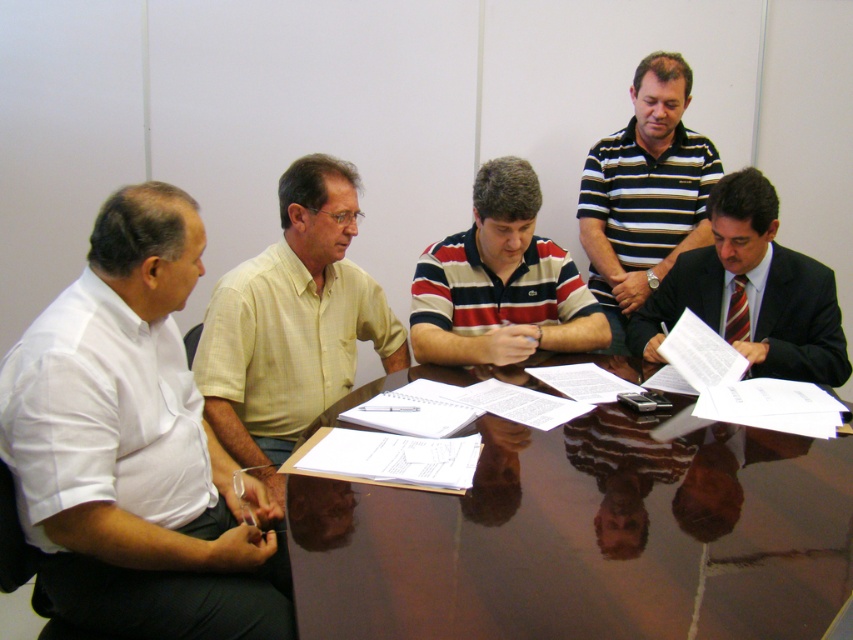
Which is more to the right, glossy brown table at center or striped cotton polo shirt at upper right?

striped cotton polo shirt at upper right is more to the right.

Is glossy brown table at center in front of striped cotton polo shirt at upper right?

Yes.

Does point (782, 538) lie in front of point (589, 250)?

That is True.

The height and width of the screenshot is (640, 853). I want to click on glossy brown table at center, so click(585, 538).

Looking at this image, who is more distant from viewer, (84, 493) or (283, 208)?

The point (283, 208) is behind.

Is point (109, 500) positioned behind point (380, 316)?

No, (109, 500) is in front of (380, 316).

Locate an element on the screen. The width and height of the screenshot is (853, 640). white shirt at left is located at coordinates (134, 448).

Locate an element on the screen. white shirt at left is located at coordinates (134, 448).

Describe the element at coordinates (134, 448) in the screenshot. The width and height of the screenshot is (853, 640). I see `white shirt at left` at that location.

Who is more distant from viewer, (111, 572) or (529, 264)?

The point (529, 264) is more distant.

Where is `white shirt at left`? white shirt at left is located at coordinates [x=134, y=448].

Where is `white shirt at left`? The image size is (853, 640). white shirt at left is located at coordinates (134, 448).